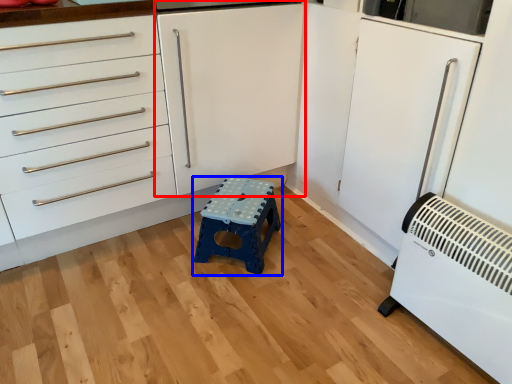
Question: Which of the following is the closest to the observer, cabinetry (highlighted by a red box) or furniture (highlighted by a blue box)?

Choices:
 (A) cabinetry
 (B) furniture

Answer: (A)